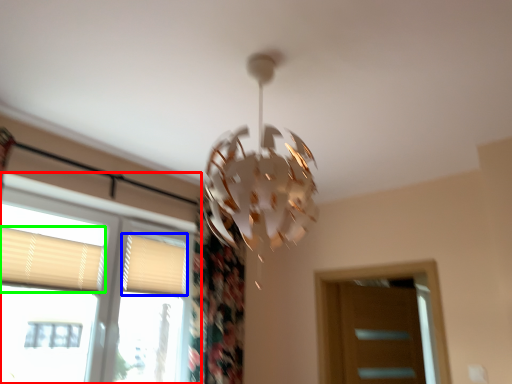
Question: Which object is the farthest from window (highlighted by a red box)? Choose among these: shutter (highlighted by a blue box) or shutter (highlighted by a green box).

Choices:
 (A) shutter
 (B) shutter

Answer: (A)